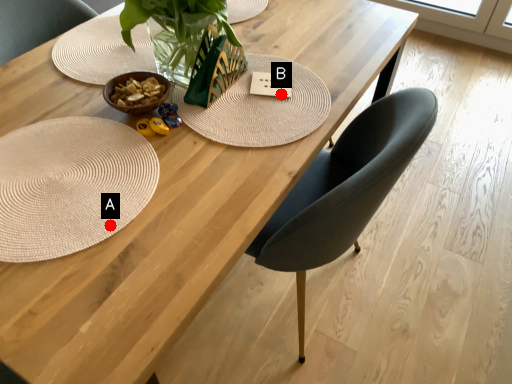
Question: Two points are circled on the image, labeled by A and B beside each circle. Which point is farther to the camera?

Choices:
 (A) A is further
 (B) B is further

Answer: (B)